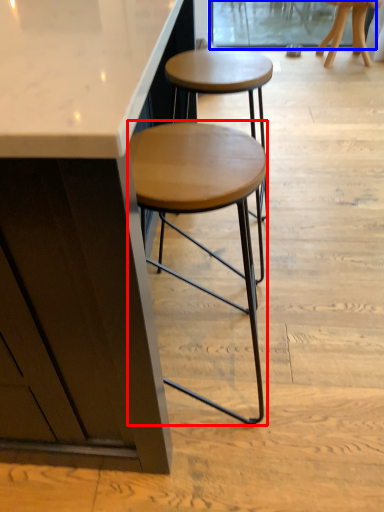
Question: Which object is closer to the camera taking this photo, stool (highlighted by a red box) or screen door (highlighted by a blue box)?

Choices:
 (A) stool
 (B) screen door

Answer: (A)